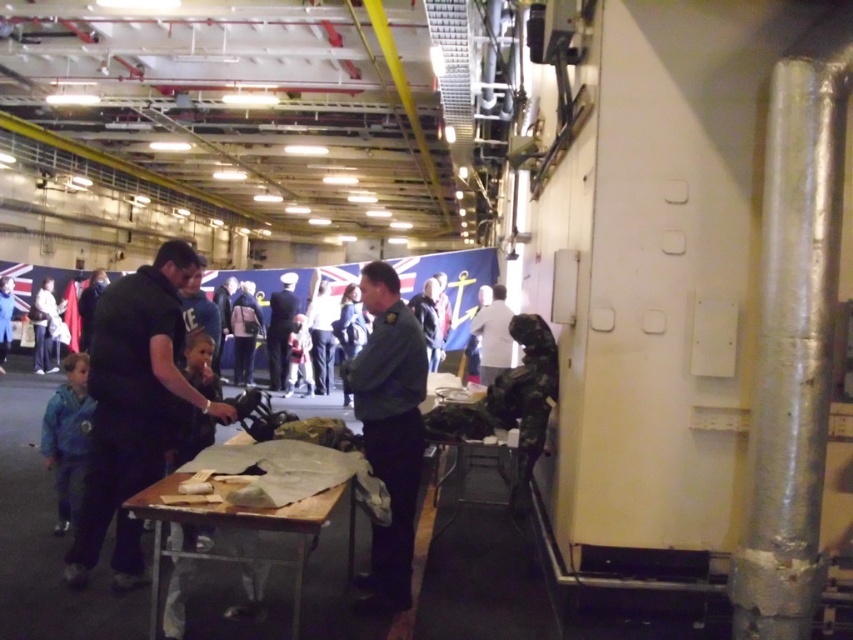
You are standing in the ship hall and want to place a small decoration between the two points marked as point (82, 353) and point (280, 332). Which point should the decoration be closer to if you want it to appear larger in the camera view?

The decoration should be placed closer to point (82, 353) because it is closer to the camera, making objects placed there appear larger in the camera view.

Based on the photo, you are organizing a clothing donation drive and need to decide which of the two jackets, the blue denim jacket at left or the light blue denim jacket at upper left, will require more space when folded. Based on their positions in the image, which jacket should you allocate more storage space for?

The blue denim jacket at left is wider than the light blue denim jacket at upper left, so you should allocate more storage space for the blue denim jacket at left when folded.

You are planning to hang a decoration from the ceiling in this indoor ship setting. The decoration requires a hook that must be placed higher than the white matte shirt at center. Can the silver metallic pipe at right provide a suitable location for this hook?

The silver metallic pipe at right has a greater height compared to the white matte shirt at center, so the pipe can provide a suitable location for the hook since it is taller than the shirt.